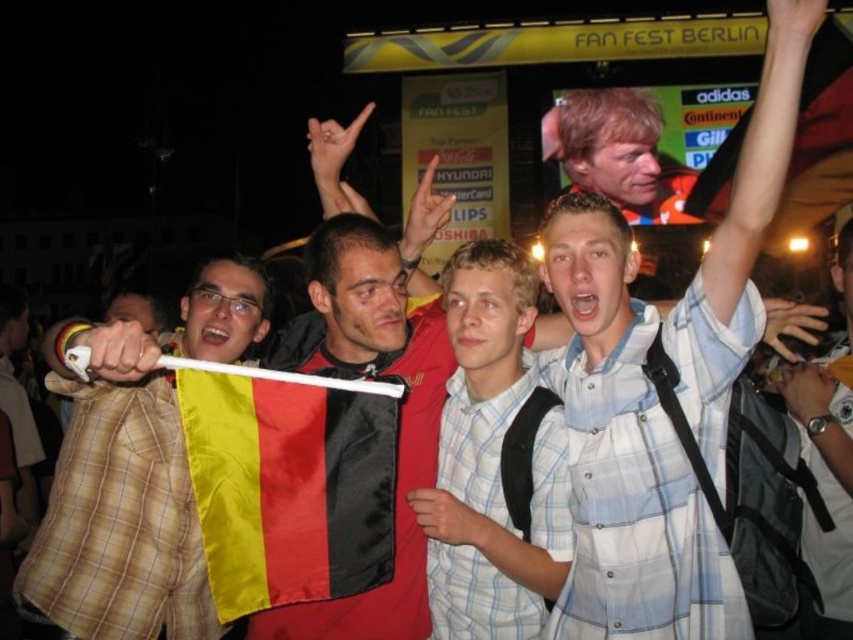
Does point (155, 500) come behind point (316, 529)?

Yes, point (155, 500) is farther from viewer.

Can you confirm if plaid shirt at left is positioned to the right of satin flag at center?

No, plaid shirt at left is not to the right of satin flag at center.

Where is `plaid shirt at left`? This screenshot has height=640, width=853. plaid shirt at left is located at coordinates (120, 506).

Is light blue plaid shirt at center bigger than smooth orange shirt at upper center?

Indeed, light blue plaid shirt at center has a larger size compared to smooth orange shirt at upper center.

Between light blue plaid shirt at center and smooth orange shirt at upper center, which one appears on the right side from the viewer's perspective?

Positioned to the right is smooth orange shirt at upper center.

Find the location of `light blue plaid shirt at center`. light blue plaid shirt at center is located at coordinates pos(491,461).

Does point (358, 573) lie in front of point (582, 157)?

Yes, point (358, 573) is in front of point (582, 157).

This screenshot has height=640, width=853. What do you see at coordinates (289, 483) in the screenshot?
I see `satin flag at center` at bounding box center [289, 483].

Find the location of a particular element. satin flag at center is located at coordinates (289, 483).